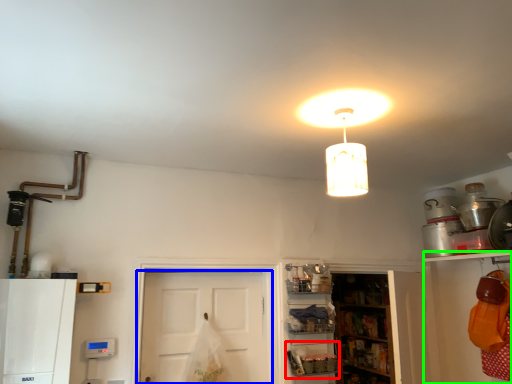
Question: Estimate the real-world distances between objects in this image. Which object is closer to shelf (highlighted by a red box), door (highlighted by a blue box) or shelf (highlighted by a green box)?

Choices:
 (A) door
 (B) shelf

Answer: (A)